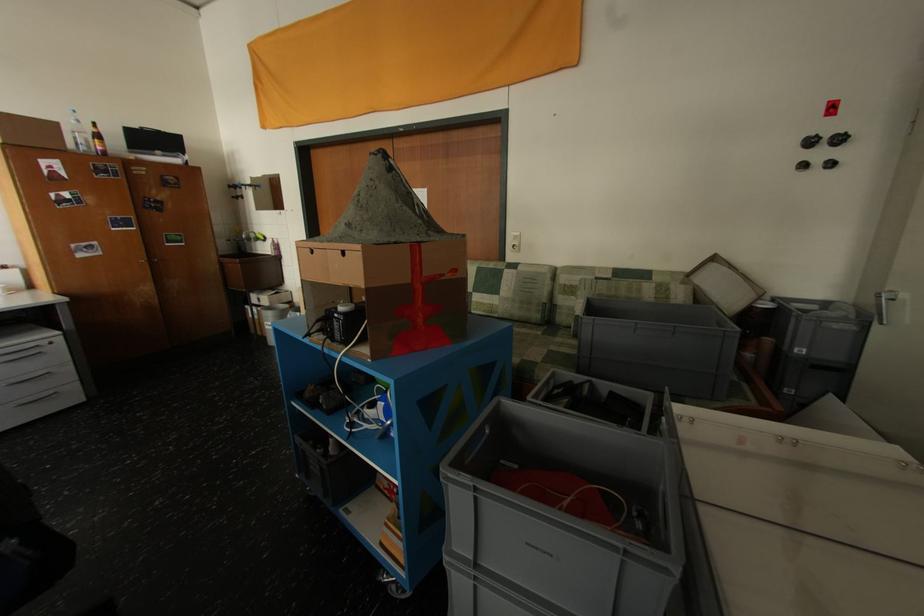
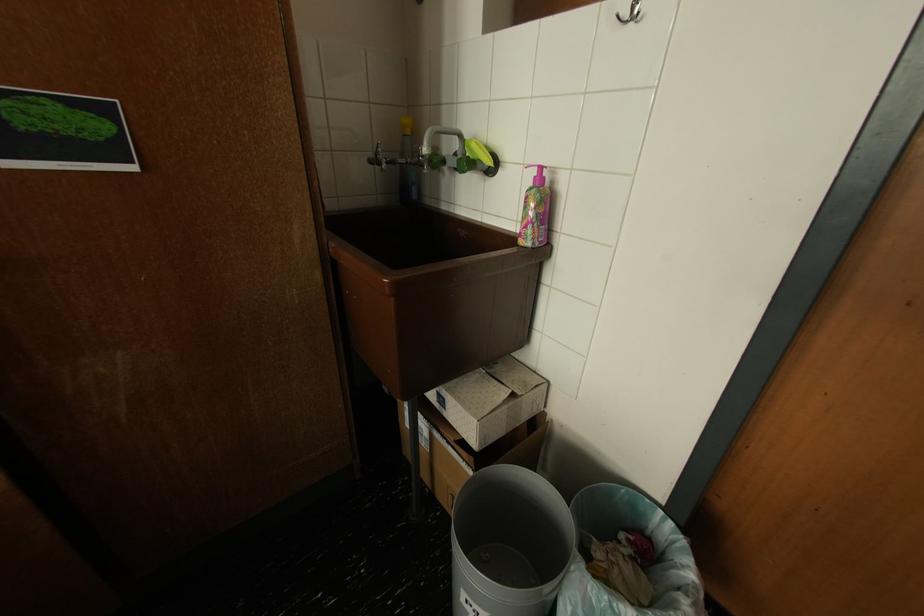
Question: I am providing you with two images of the same scene from different viewpoints. Which of the following objects are not visible in image2?

Choices:
 (A) pink soap bottle
 (B) faucet spout
 (C) metal wall hook
 (D) none of these

Answer: (D)